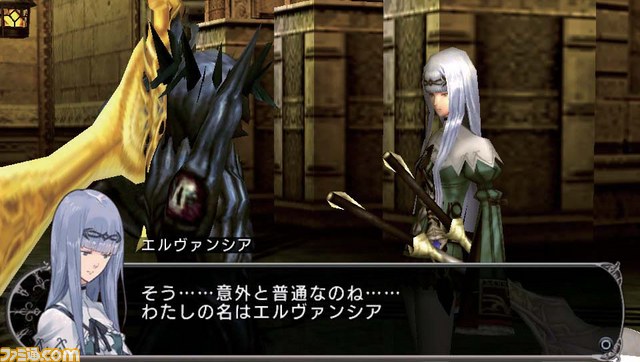
Identify the location of wall. This screenshot has height=362, width=640. (70, 19).